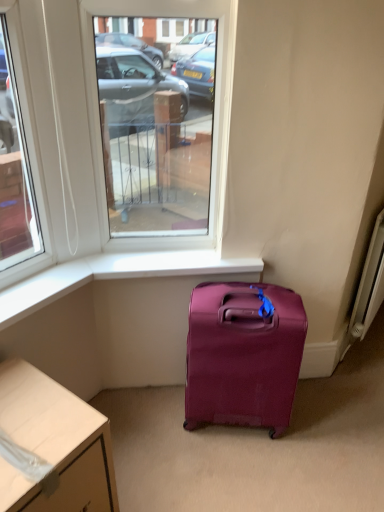
Image resolution: width=384 pixels, height=512 pixels. I want to click on free spot to the left of matte purple suitcase at lower center, so click(156, 426).